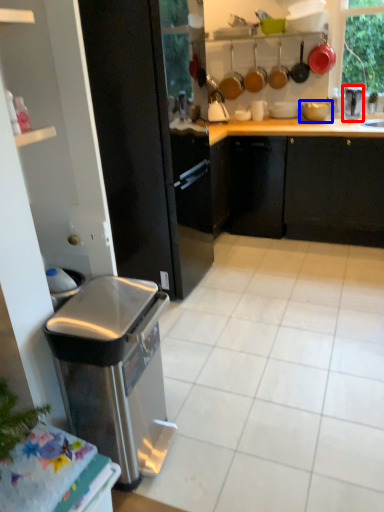
Question: Which object appears farthest to the camera in this image, appliance (highlighted by a red box) or appliance (highlighted by a blue box)?

Choices:
 (A) appliance
 (B) appliance

Answer: (B)